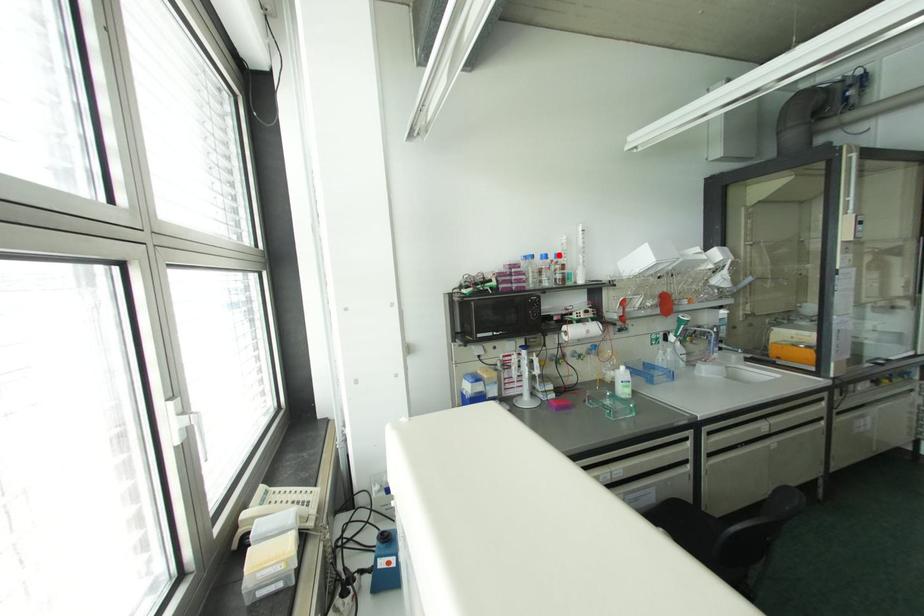
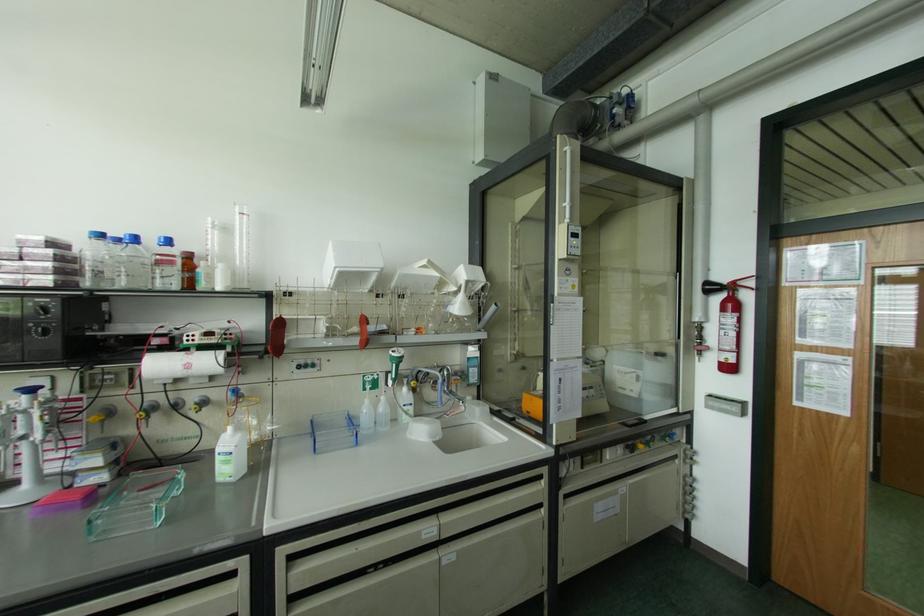
In the second image, find the point that corresponds to the highlighted location in the first image.

(167, 241)